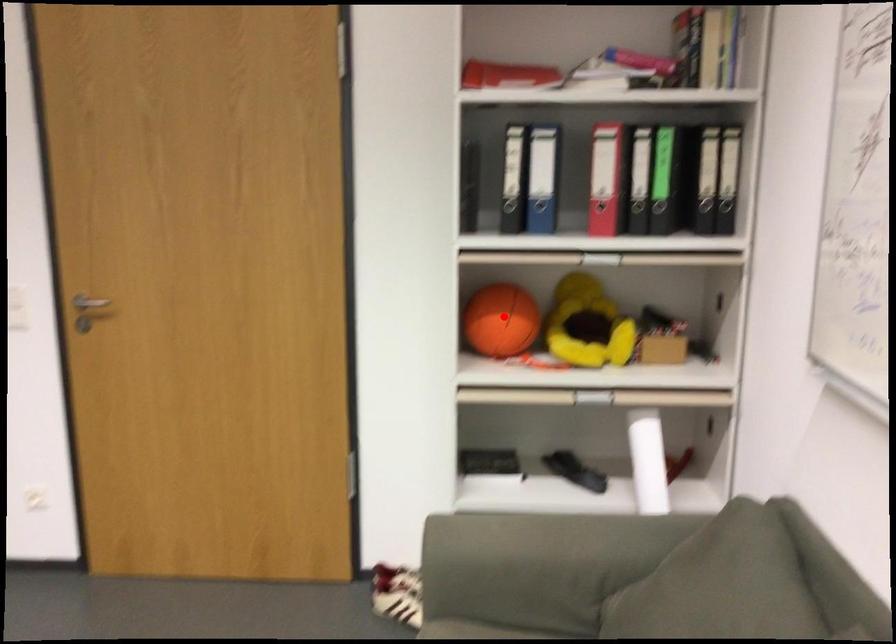
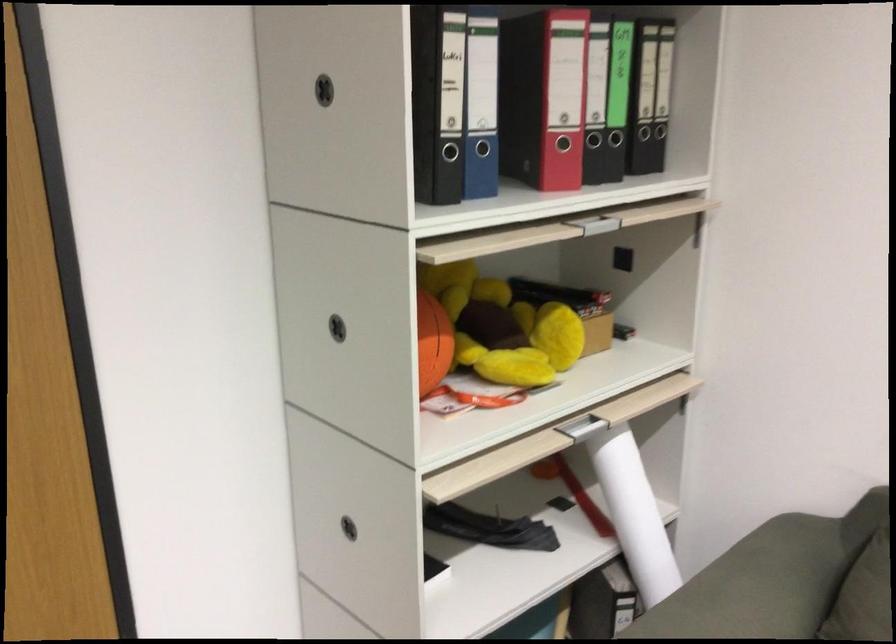
Locate, in the second image, the point that corresponds to the highlighted location in the first image.

(433, 343)